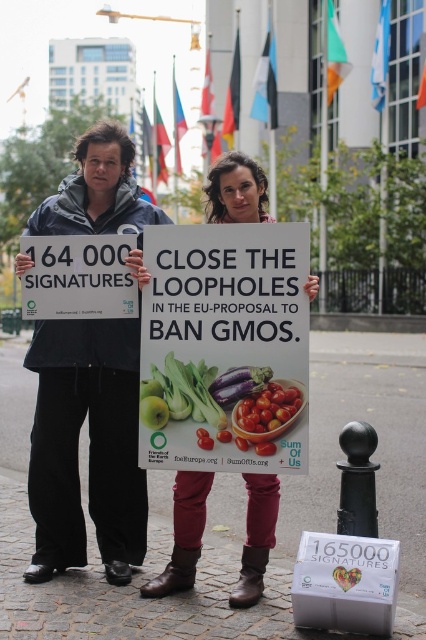
You are organizing a protest and need to place two signs next to each other. The first sign has green matte vegetables at center and the second has green matte apple at center. If the space between them must be exactly 12 inches, will they fit perfectly? Explain your answer.

The green matte vegetables at center and green matte apple at center are 11.64 inches apart, which is less than 12 inches. Therefore, they are slightly closer than required. To fit exactly 12 inches apart, they need to be moved slightly further apart.

You are a photographer trying to capture the shiny red tomatoes at center in the image. There is a matte plastic sign at center blocking your view. Can you adjust your angle to see the tomatoes without moving the sign?

The matte plastic sign at center is located above the shiny red tomatoes at center, so you can lower your camera angle to see the tomatoes below the sign without moving the sign.

You are a photographer standing in front of the protesters. You want to take a photo that captures both the matte black jacket at center and the green matte vegetables at center in the same frame. The minimum distance between the two objects must be at least 4 feet to ensure both are clearly visible. Can you take the photo with your current positioning?

The distance between the matte black jacket at center and the green matte vegetables at center is 3.40 feet, which is less than the required 4 feet. Therefore, you cannot take the photo with your current positioning as the objects are too close to each other for both to be clearly visible.